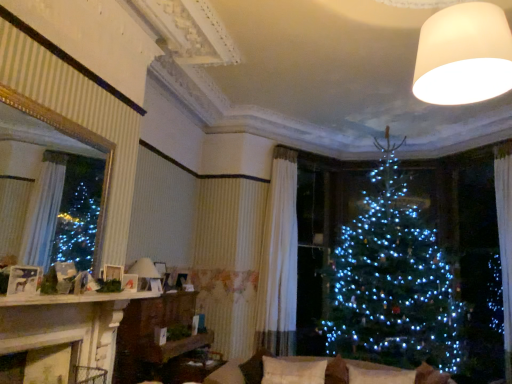
Identify the location of vacant point above gold-framed mirror at left (from a real-world perspective). Image resolution: width=512 pixels, height=384 pixels. (48, 109).